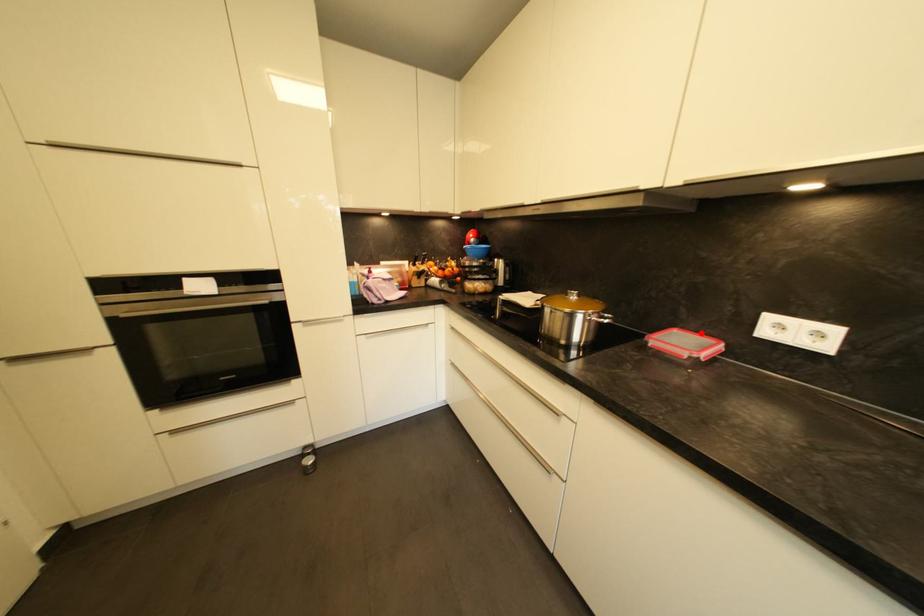
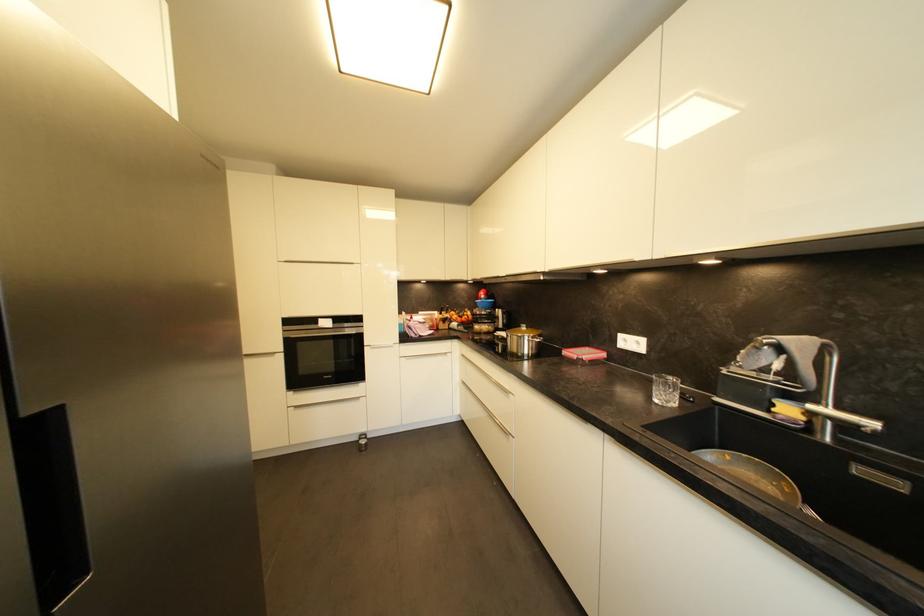
Find the pixel in the second image that matches the highlighted location in the first image.

(602, 350)